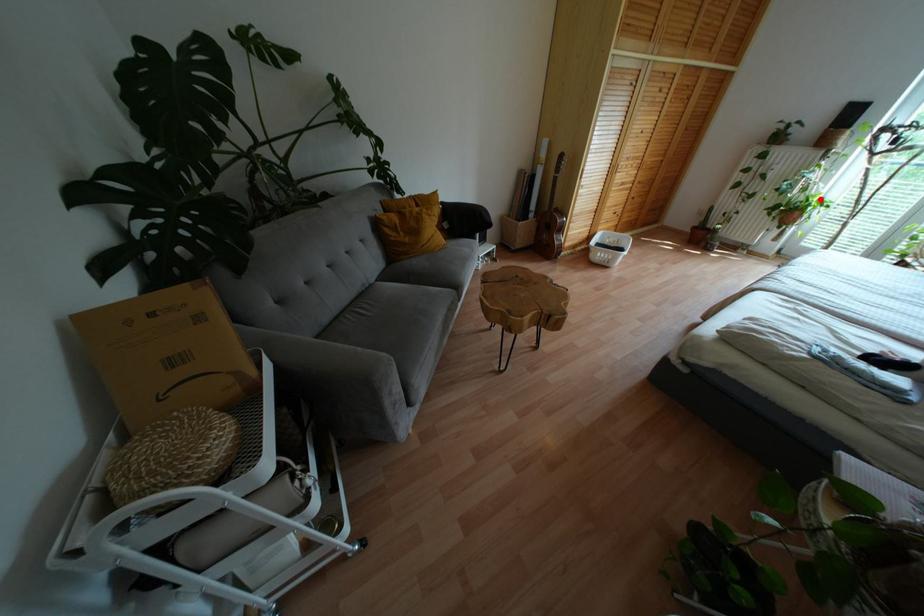
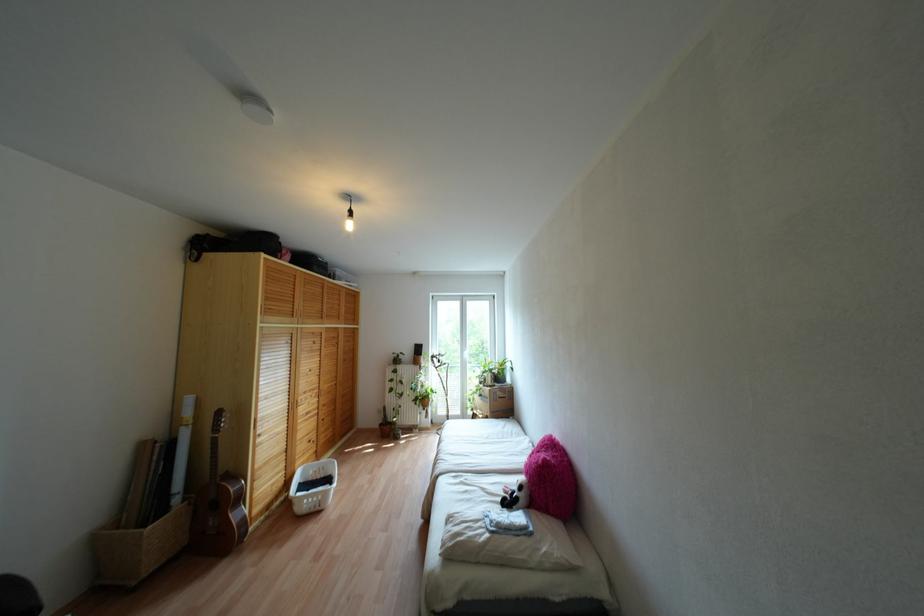
The point at the highlighted location is marked in the first image. Where is the corresponding point in the second image?

(431, 389)